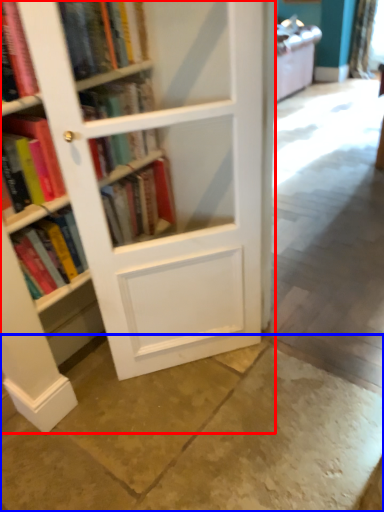
Question: Which point is further to the camera, bookcase (highlighted by a red box) or concrete (highlighted by a blue box)?

Choices:
 (A) bookcase
 (B) concrete

Answer: (A)